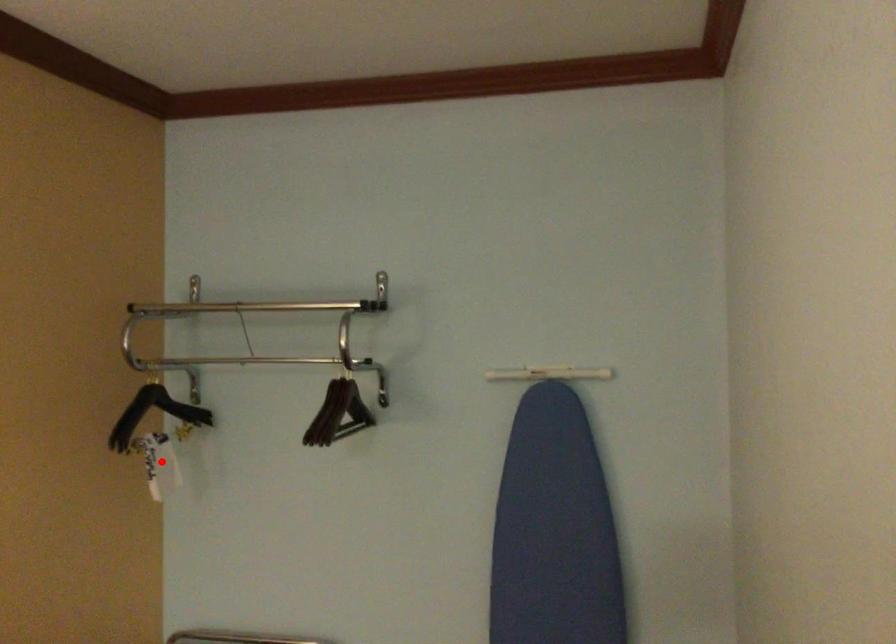
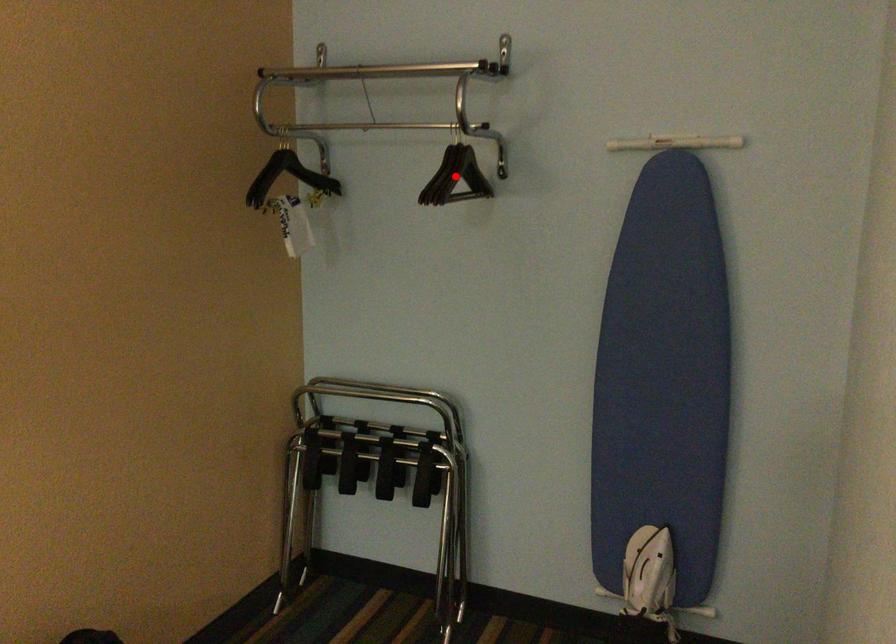
I am providing you with two images of the same scene from different viewpoints. A red point is marked on the first image and another point is marked on the second image. Do the highlighted points in image1 and image2 indicate the same real-world spot?

No